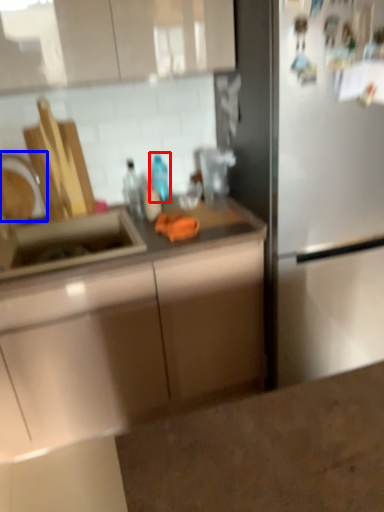
Question: Which object is closer to the camera taking this photo, bottle (highlighted by a red box) or faucet (highlighted by a blue box)?

Choices:
 (A) bottle
 (B) faucet

Answer: (B)